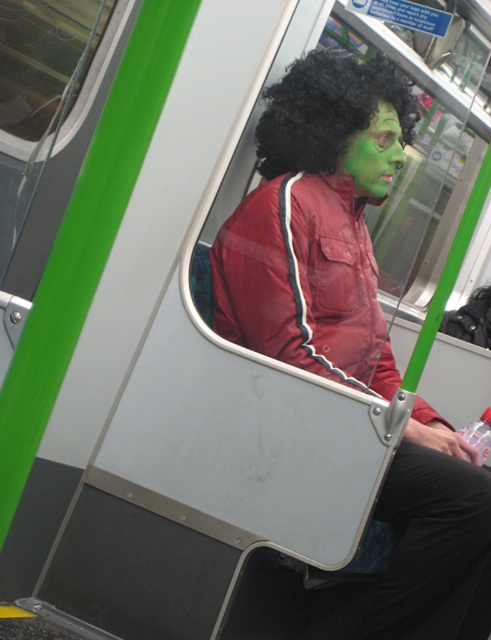
Looking at this image, does black curly wig at upper center appear under green matte face at center?

Incorrect, black curly wig at upper center is not positioned below green matte face at center.

Can you confirm if black curly wig at upper center is positioned above green matte face at center?

Yes.

What do you see at coordinates (327, 109) in the screenshot?
I see `black curly wig at upper center` at bounding box center [327, 109].

This screenshot has width=491, height=640. I want to click on black curly wig at upper center, so click(327, 109).